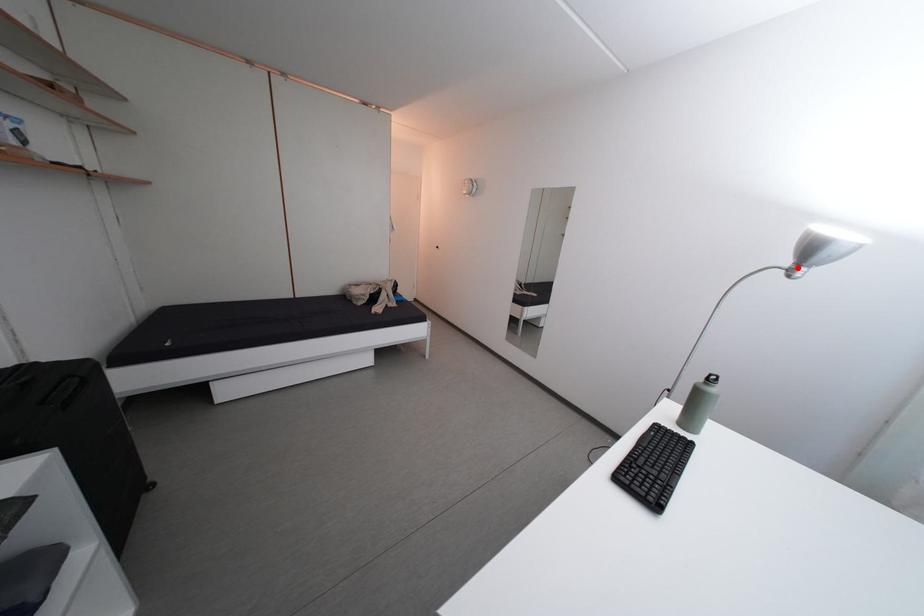
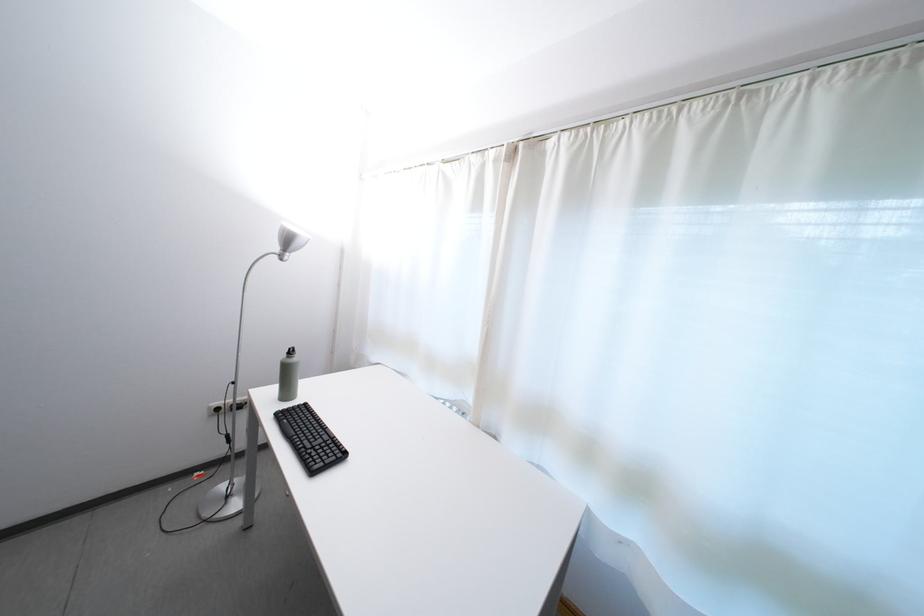
The point at the highlighted location is marked in the first image. Where is the corresponding point in the second image?

(286, 254)